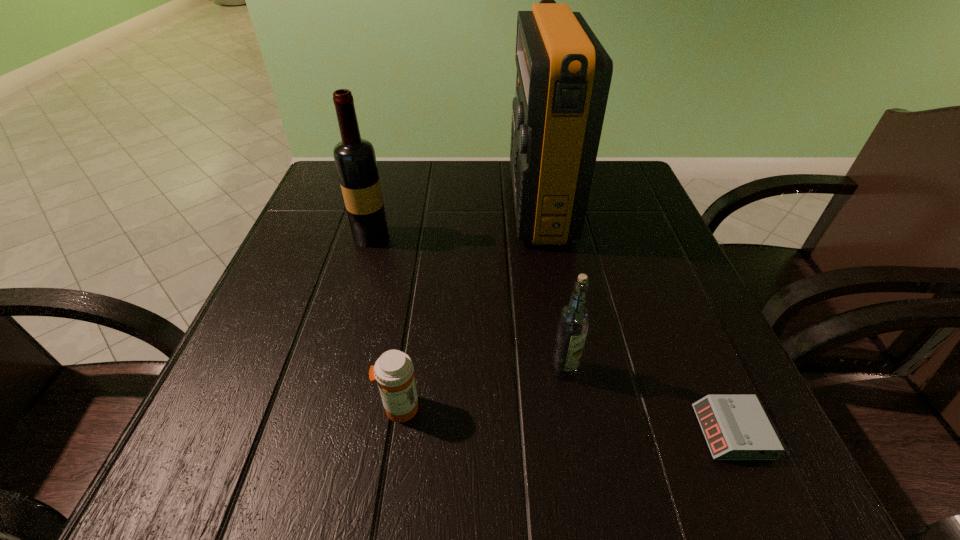
This screenshot has height=540, width=960. I want to click on the tallest object, so click(564, 74).

This screenshot has height=540, width=960. Identify the location of the leftmost object. (355, 160).

This screenshot has height=540, width=960. Identify the location of the fourth shortest object. (355, 160).

Image resolution: width=960 pixels, height=540 pixels. Find the location of `the third shortest object`. the third shortest object is located at coordinates (574, 318).

This screenshot has height=540, width=960. In order to click on the third nearest object in this screenshot , I will do `click(574, 318)`.

You are a GUI agent. You are given a task and a screenshot of the screen. Output one action in this format:
    pyautogui.click(x=<x>, y=<y>)
    Task: Click on the second object from left to right
    The image size is (960, 540).
    Given the screenshot: What is the action you would take?
    pyautogui.click(x=394, y=372)

Find the location of a particular element. the fourth tallest object is located at coordinates (394, 372).

At what (x,y) coordinates should I click in order to perform the action: click on alarm clock. Please return your answer as a coordinate pair (x, y). The image size is (960, 540). Looking at the image, I should click on (736, 427).

The width and height of the screenshot is (960, 540). Find the location of `the shortest object`. the shortest object is located at coordinates (736, 427).

I want to click on blank space located on the front-facing side of the radio receiver, so click(x=348, y=203).